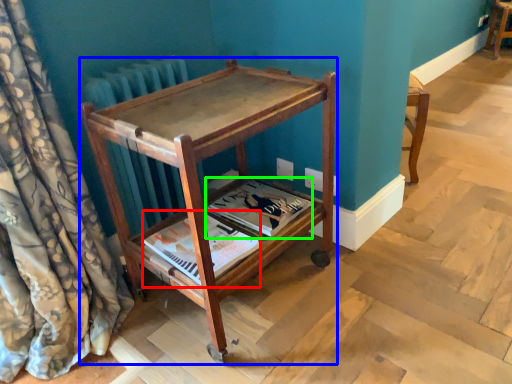
Question: Estimate the real-world distances between objects in this image. Which object is farther from magazine (highlighted by a red box), furniture (highlighted by a blue box) or magazine (highlighted by a green box)?

Choices:
 (A) furniture
 (B) magazine

Answer: (A)